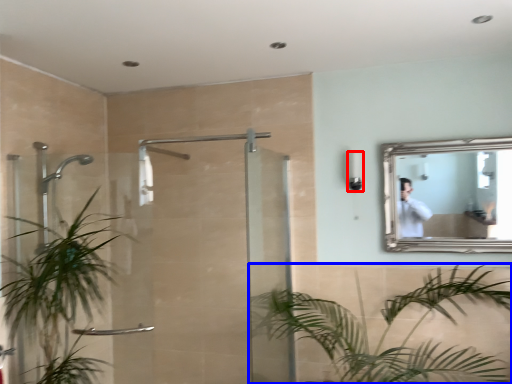
Question: Which object is closer to the camera taking this photo, light fixture (highlighted by a red box) or houseplant (highlighted by a blue box)?

Choices:
 (A) light fixture
 (B) houseplant

Answer: (B)